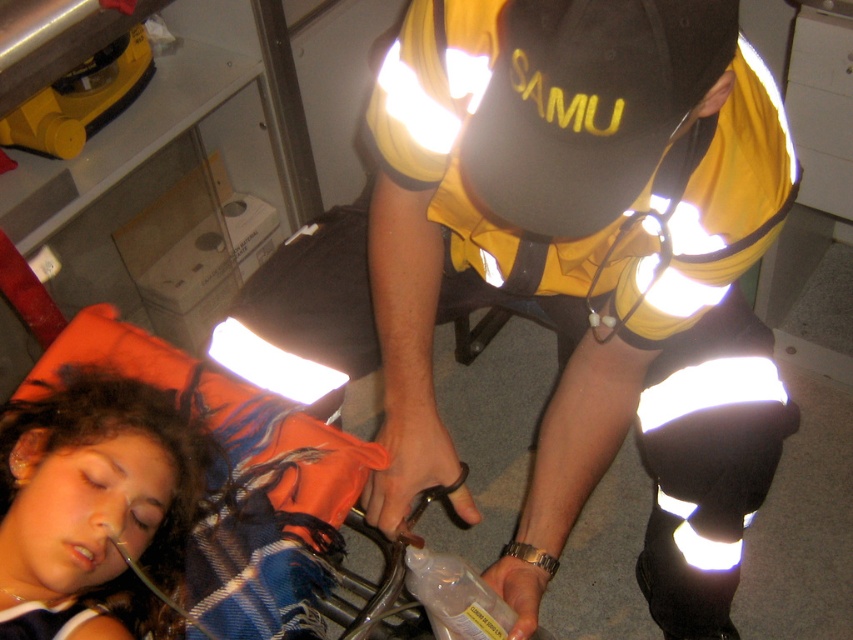
Which of these two, reflective yellow vest at center or orange fabric pillow at lower left, stands shorter?

With less height is orange fabric pillow at lower left.

Between reflective yellow vest at center and orange fabric pillow at lower left, which one is positioned higher?

reflective yellow vest at center

Does point (663, 32) come behind point (65, 545)?

That is False.

You are a GUI agent. You are given a task and a screenshot of the screen. Output one action in this format:
    pyautogui.click(x=<x>, y=<y>)
    Task: Click on the reflective yellow vest at center
    This screenshot has width=853, height=640.
    Given the screenshot: What is the action you would take?
    pyautogui.click(x=566, y=221)